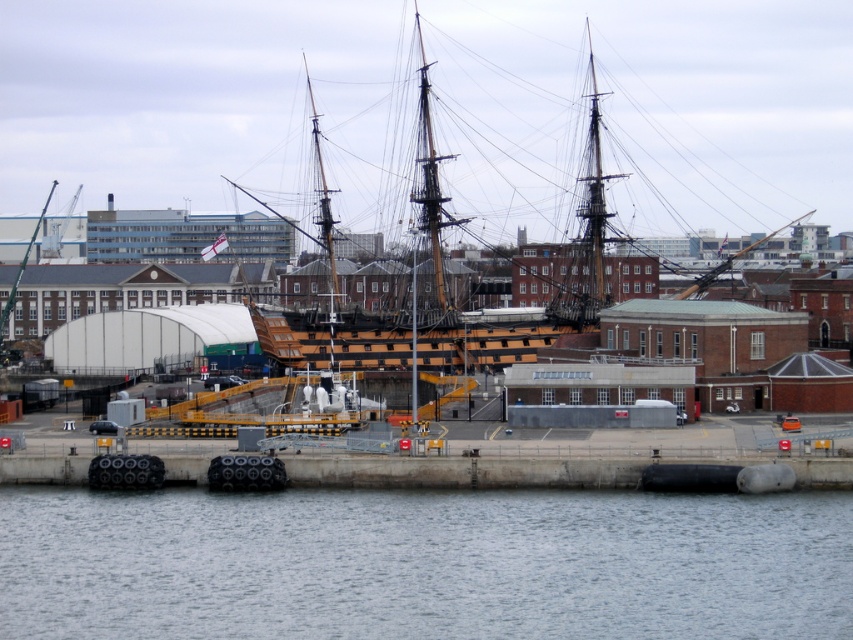
Question: Does wooden ship at center have a smaller size compared to clear water at lower center?

Choices:
 (A) yes
 (B) no

Answer: (B)

Question: Which of these objects is positioned farthest from the wooden ship at center?

Choices:
 (A) green matte mast at upper center
 (B) clear water at lower center

Answer: (B)

Question: Can you confirm if wooden ship at center is positioned to the left of green matte mast at upper center?

Choices:
 (A) yes
 (B) no

Answer: (B)

Question: Which point is closer to the camera?

Choices:
 (A) (12, 298)
 (B) (447, 509)
 (C) (540, 116)

Answer: (B)

Question: Which of the following is the farthest from the observer?

Choices:
 (A) (54, 180)
 (B) (440, 26)

Answer: (A)

Question: Does clear water at lower center come in front of green matte mast at upper center?

Choices:
 (A) no
 (B) yes

Answer: (B)